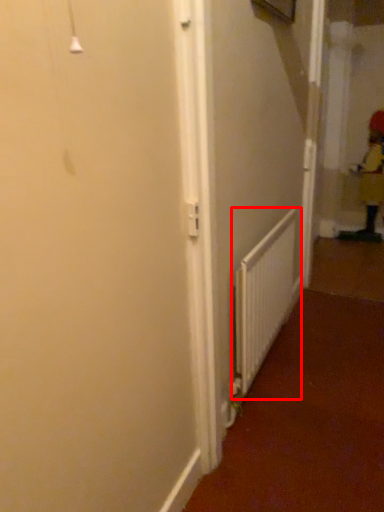
Question: From the image's perspective, what is the correct spatial positioning of radiator (annotated by the red box) in reference to worker?

Choices:
 (A) below
 (B) above

Answer: (A)